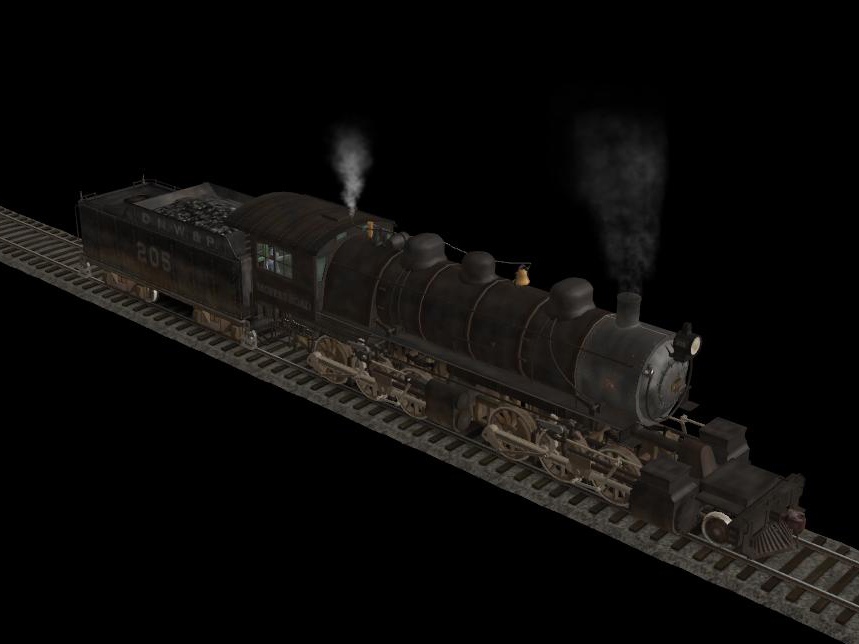
In order to click on yellow knob in this screenshot , I will do `click(521, 279)`.